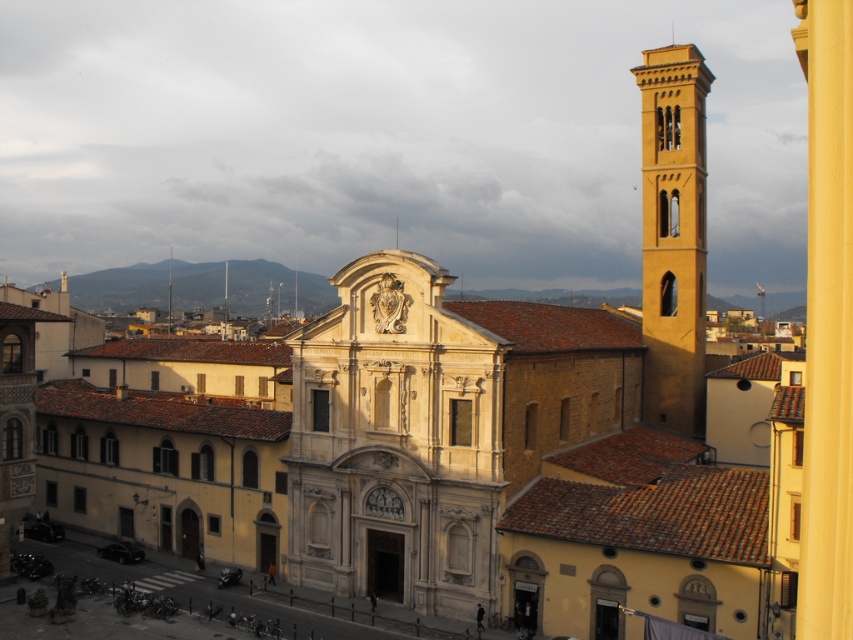
Does yellow smooth pillar at center appear under matte yellow bell tower at right?

No.

Between yellow smooth pillar at center and matte yellow bell tower at right, which one appears on the left side from the viewer's perspective?

matte yellow bell tower at right

This screenshot has width=853, height=640. What are the coordinates of `yellow smooth pillar at center` in the screenshot? It's located at (827, 321).

Locate an element on the screen. Image resolution: width=853 pixels, height=640 pixels. yellow smooth pillar at center is located at coordinates (827, 321).

Locate an element on the screen. The image size is (853, 640). white stone church at center is located at coordinates (396, 442).

Is white stone church at center closer to camera compared to matte yellow bell tower at right?

Yes, white stone church at center is closer to the viewer.

Which is in front, point (480, 449) or point (645, 106)?

Positioned in front is point (480, 449).

What are the coordinates of `white stone church at center` in the screenshot? It's located at (396, 442).

Can you confirm if white stone church at center is shorter than yellow smooth pillar at center?

Indeed, white stone church at center has a lesser height compared to yellow smooth pillar at center.

Based on the photo, between white stone church at center and yellow smooth pillar at center, which one has less height?

white stone church at center

You are a GUI agent. You are given a task and a screenshot of the screen. Output one action in this format:
    pyautogui.click(x=<x>, y=<y>)
    Task: Click on the white stone church at center
    The width and height of the screenshot is (853, 640).
    Given the screenshot: What is the action you would take?
    pyautogui.click(x=396, y=442)